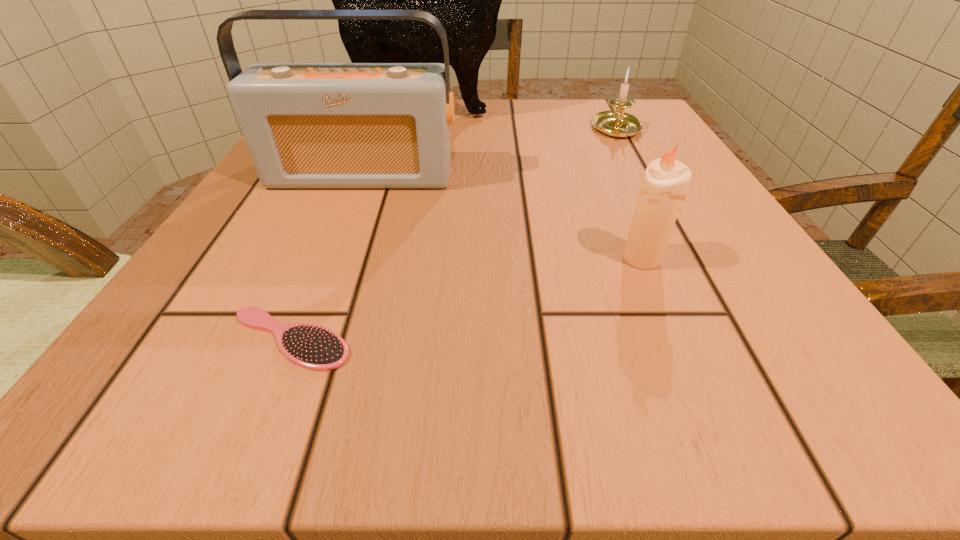
Locate an element on the screen. free space between the candle holder and the hairbrush is located at coordinates (453, 234).

This screenshot has height=540, width=960. Find the location of `vacant point located between the tallest object and the fourth tallest object`. vacant point located between the tallest object and the fourth tallest object is located at coordinates (518, 123).

Identify the location of free area in between the hairbrush and the cat. (354, 227).

You are a GUI agent. You are given a task and a screenshot of the screen. Output one action in this format:
    pyautogui.click(x=<x>, y=<y>)
    Task: Click on the free space between the third tallest object and the cat
    The height and width of the screenshot is (540, 960).
    Given the screenshot: What is the action you would take?
    pyautogui.click(x=531, y=187)

The height and width of the screenshot is (540, 960). Find the location of `free space between the second nearest object and the cat`. free space between the second nearest object and the cat is located at coordinates (531, 187).

Where is `free space between the fourth tallest object and the radio receiver`? free space between the fourth tallest object and the radio receiver is located at coordinates (490, 153).

Locate an element on the screen. vacant region between the third tallest object and the candle holder is located at coordinates (630, 194).

This screenshot has height=540, width=960. Identify the location of unoccupied area between the fourth shortest object and the third shortest object. (502, 217).

Locate an element on the screen. The height and width of the screenshot is (540, 960). the fourth closest object relative to the third nearest object is located at coordinates (618, 124).

Where is `object identified as the closest to the fourth farthest object`? Image resolution: width=960 pixels, height=540 pixels. object identified as the closest to the fourth farthest object is located at coordinates (307, 125).